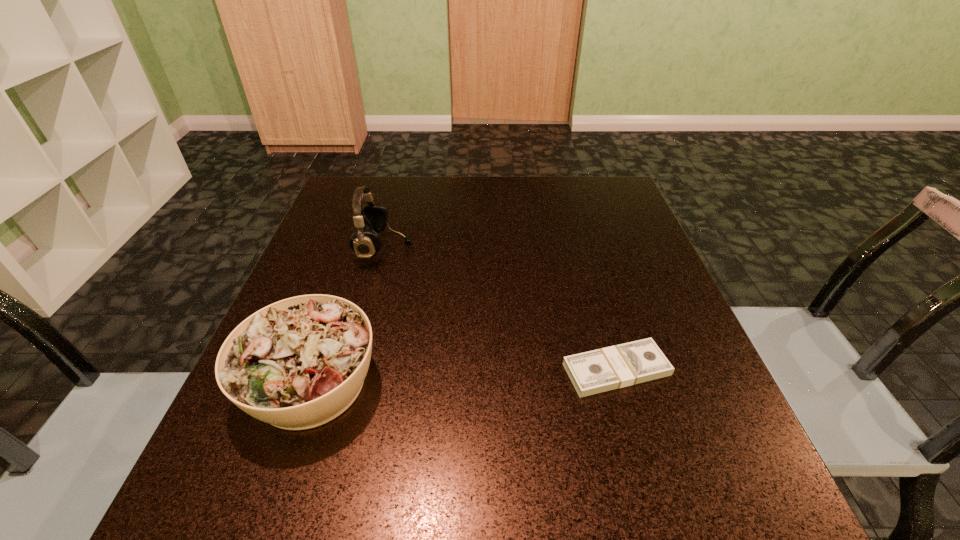
The width and height of the screenshot is (960, 540). In order to click on vacant space in between the tallest object and the shortest object in this screenshot , I will do `click(500, 308)`.

The height and width of the screenshot is (540, 960). What are the coordinates of `unoccupied area between the tallest object and the dollar` in the screenshot? It's located at (500, 308).

This screenshot has height=540, width=960. I want to click on vacant area that lies between the farthest object and the rightmost object, so click(x=500, y=308).

I want to click on blank region between the dollar and the second shortest object, so click(x=464, y=376).

Identify the location of the closest object to the shortest object. (298, 363).

The image size is (960, 540). I want to click on object identified as the closest to the headset, so click(x=298, y=363).

In order to click on free space that satisfies the following two spatial constraints: 1. on the back side of the dollar; 2. with the microphone on the side of the headset in this screenshot , I will do `click(582, 247)`.

This screenshot has width=960, height=540. In order to click on vacant space that satisfies the following two spatial constraints: 1. on the back side of the shortest object; 2. on the left side of the second shortest object in this screenshot , I will do `click(316, 369)`.

Where is `vacant point that satisfies the following two spatial constraints: 1. with the microphone on the side of the farthest object; 2. on the back side of the rightmost object`? This screenshot has height=540, width=960. vacant point that satisfies the following two spatial constraints: 1. with the microphone on the side of the farthest object; 2. on the back side of the rightmost object is located at coordinates (351, 369).

Find the location of a particular element. The height and width of the screenshot is (540, 960). free location that satisfies the following two spatial constraints: 1. with the microphone on the side of the headset; 2. on the front side of the second shortest object is located at coordinates (348, 383).